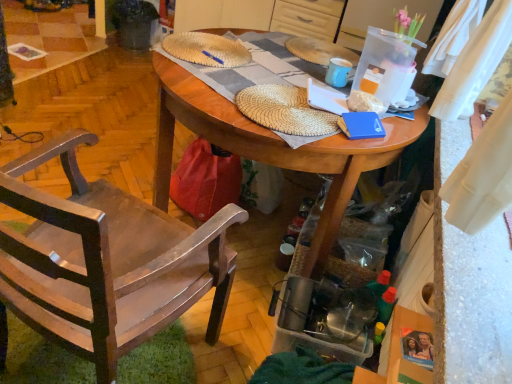
Find the location of a particular element. Image resolution: width=512 pixels, height=384 pixels. free spot above woven straw hat at center, which is the second hat from back to front (from a real-world perspective) is located at coordinates (304, 99).